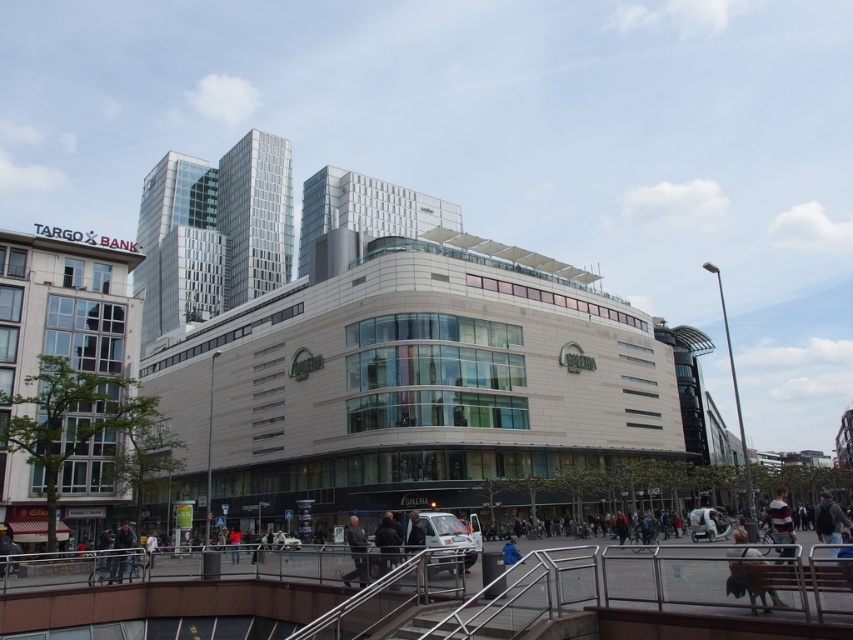
You are standing at the point closest to the camera in the image. There are two points marked in the scene, one at coordinates point (126, 528) and another at point (511, 561). Which point are you currently standing at?

You are standing at point (511, 561) because it is closer to the camera than point (126, 528).

You are an assistant at a clothing store and need to arrange two items on a mannequin. The items are the dark gray suit at center and the blue fabric jacket at lower center. According to the image, which item should be placed on top to match the displayed arrangement?

The blue fabric jacket at lower center should be placed on top of the dark gray suit at center because the dark gray suit at center is located below the blue fabric jacket at lower center in the image.

You are a pedestrian standing in front of the Galeria building. You see a dark gray jacket at lower left and a blue fabric jacket at lower center. Which jacket is closer to the TARGO BANK building?

The dark gray jacket at lower left is closer to the TARGO BANK building because it is positioned to the left of the blue fabric jacket at lower center, and the TARGO BANK building is located to the left of the Galeria building.